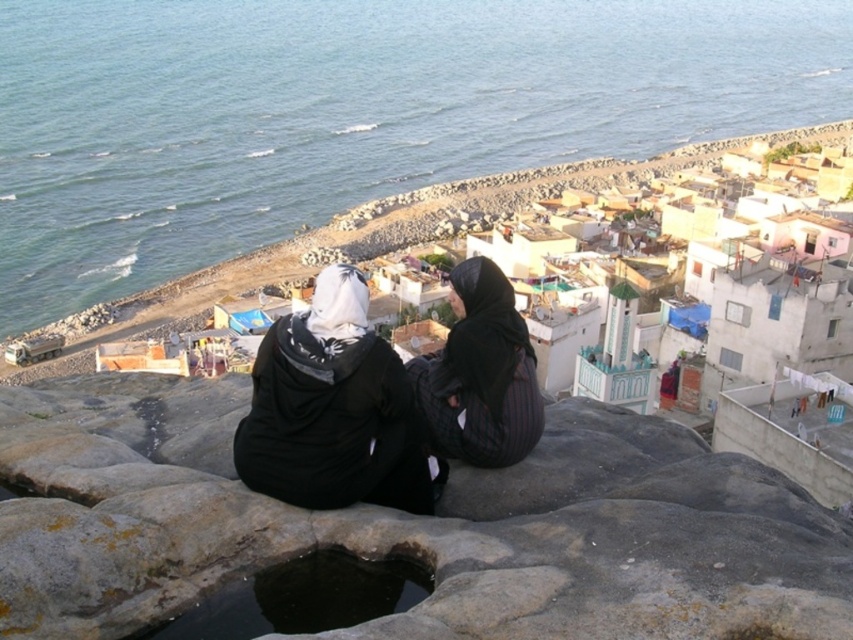
Question: Considering the relative positions of blue water at center and gray rough stone at center in the image provided, where is blue water at center located with respect to gray rough stone at center?

Choices:
 (A) right
 (B) left

Answer: (A)

Question: Can you confirm if blue water at center is wider than black textured fabric at center?

Choices:
 (A) yes
 (B) no

Answer: (A)

Question: Which object appears closest to the camera in this image?

Choices:
 (A) black matte hijab at center
 (B) black textured fabric at center
 (C) blue water at center
 (D) dark stone hole at center

Answer: (D)

Question: Which of the following is the closest to the observer?

Choices:
 (A) black textured fabric at center
 (B) black matte hijab at center

Answer: (B)

Question: Among these objects, which one is nearest to the camera?

Choices:
 (A) dark stone hole at center
 (B) black textured fabric at center

Answer: (A)

Question: Does gray rough stone at center have a smaller size compared to black matte hijab at center?

Choices:
 (A) no
 (B) yes

Answer: (A)